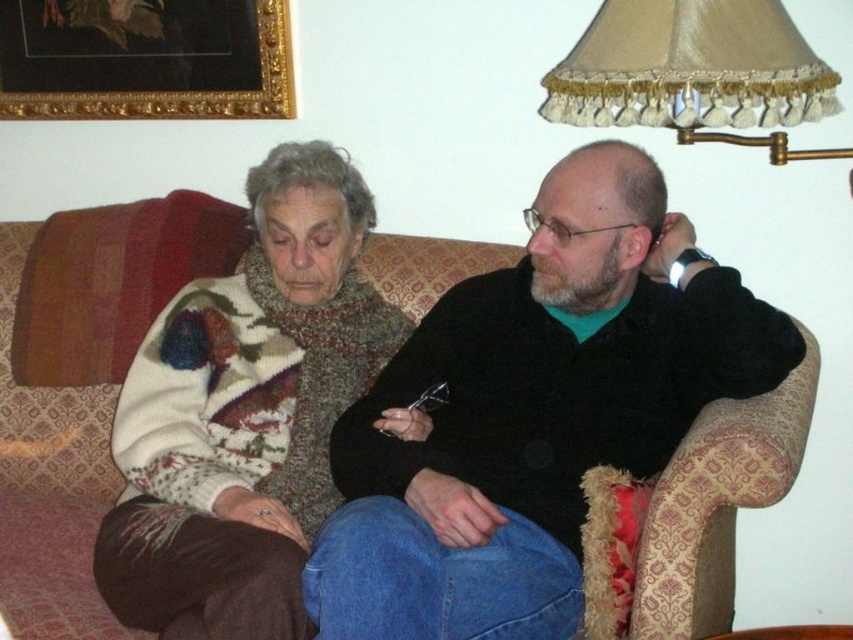
Is black matte jacket at center positioned behind beige satin lampshade at upper right?

No, black matte jacket at center is closer to the viewer.

Can you confirm if black matte jacket at center is positioned to the right of beige satin lampshade at upper right?

In fact, black matte jacket at center is to the left of beige satin lampshade at upper right.

The width and height of the screenshot is (853, 640). I want to click on black matte jacket at center, so click(532, 412).

Locate an element on the screen. The image size is (853, 640). black matte jacket at center is located at coordinates (532, 412).

Who is more distant from viewer, (257, 582) or (113, 113)?

The point (113, 113) is behind.

Is knitted sweater at left shorter than gold-framed picture at upper left?

Incorrect, knitted sweater at left's height does not fall short of gold-framed picture at upper left's.

Describe the element at coordinates (245, 413) in the screenshot. I see `knitted sweater at left` at that location.

Where is `knitted sweater at left`? The image size is (853, 640). knitted sweater at left is located at coordinates (245, 413).

Who is more distant from viewer, (338, 456) or (51, 116)?

The point (51, 116) is behind.

You are a GUI agent. You are given a task and a screenshot of the screen. Output one action in this format:
    pyautogui.click(x=<x>, y=<y>)
    Task: Click on the black matte jacket at center
    This screenshot has width=853, height=640.
    Given the screenshot: What is the action you would take?
    pyautogui.click(x=532, y=412)